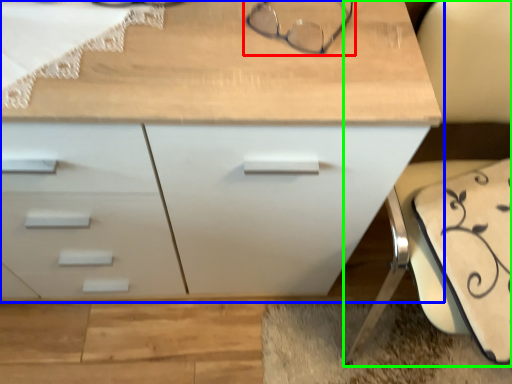
Question: Which object is positioned closest to glasses (highlighted by a red box)? Select from chest of drawers (highlighted by a blue box) and swivel chair (highlighted by a green box).

Choices:
 (A) chest of drawers
 (B) swivel chair

Answer: (A)